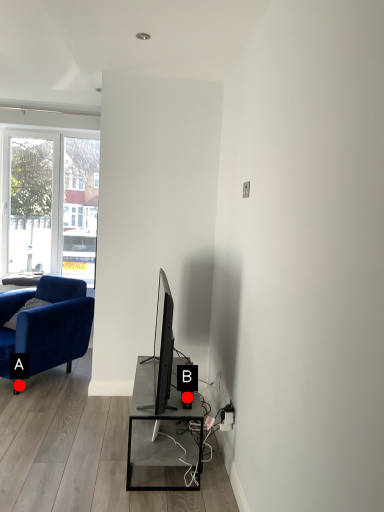
Question: Two points are circled on the image, labeled by A and B beside each circle. Which of the following is the farthest from the observer?

Choices:
 (A) A is further
 (B) B is further

Answer: (A)